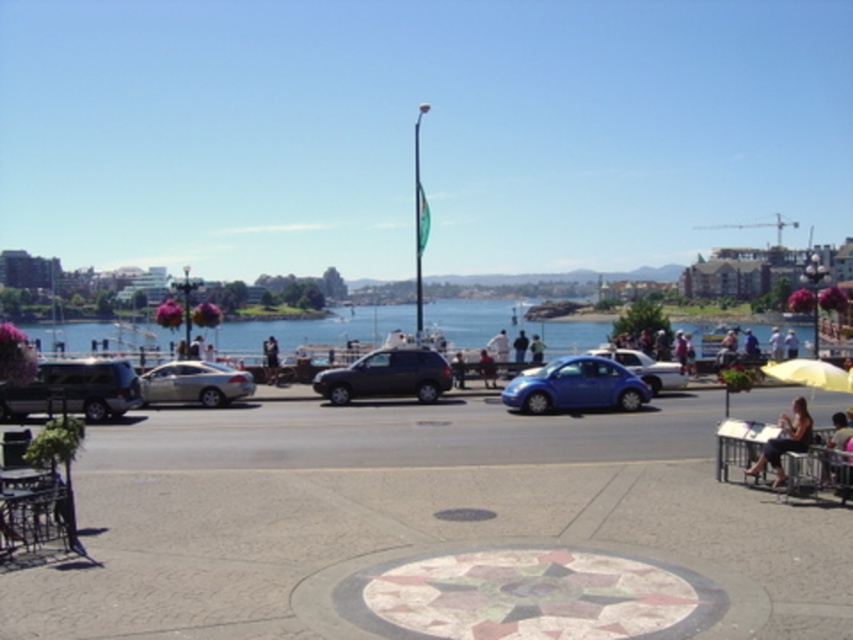
Is point (97, 417) farther from viewer compared to point (541, 353)?

No, (97, 417) is closer to viewer.

Measure the distance between matte black suv at left and light blue fabric shirt at center.

The distance of matte black suv at left from light blue fabric shirt at center is 21.35 meters.

Which is behind, point (22, 401) or point (538, 340)?

The point (538, 340) is more distant.

Where is `matte black suv at left`? The height and width of the screenshot is (640, 853). matte black suv at left is located at coordinates (73, 388).

Can you confirm if blue matte hatchback at center is taller than light blue fabric shirt at center?

Incorrect, blue matte hatchback at center's height is not larger of light blue fabric shirt at center's.

Which is more to the left, blue matte hatchback at center or light blue fabric shirt at center?

Positioned to the left is blue matte hatchback at center.

Who is more forward, [663,387] or [543,356]?

Point [663,387] is more forward.

This screenshot has width=853, height=640. I want to click on blue matte hatchback at center, so click(646, 369).

From the picture: Can you confirm if yellow matte umbrella at right is smaller than blue matte hatchback at center?

Incorrect, yellow matte umbrella at right is not smaller in size than blue matte hatchback at center.

Locate an element on the screen. Image resolution: width=853 pixels, height=640 pixels. yellow matte umbrella at right is located at coordinates (809, 372).

Between point (799, 371) and point (646, 365), which one is positioned in front?

Point (799, 371)

Locate an element on the screen. The width and height of the screenshot is (853, 640). yellow matte umbrella at right is located at coordinates (809, 372).